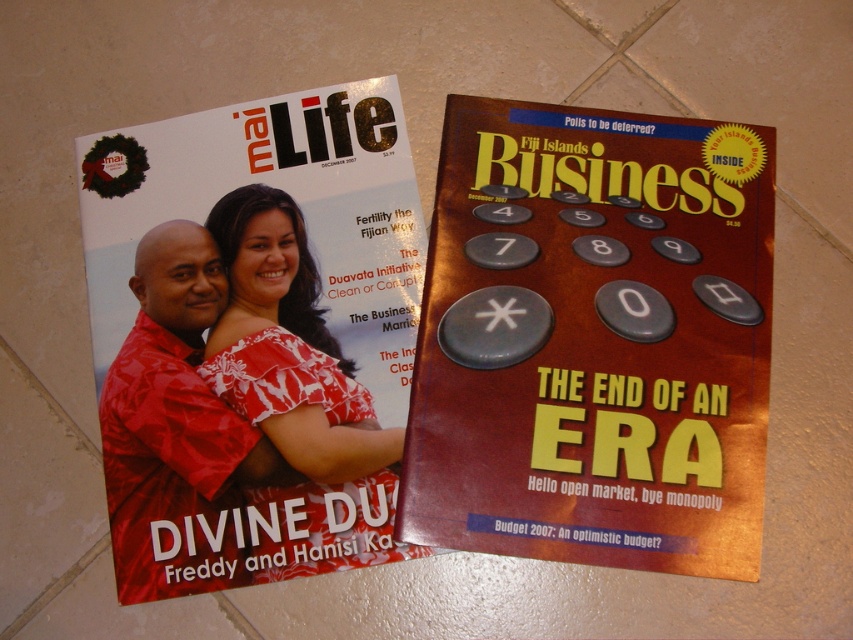
In the scene shown: Can you confirm if matte red magazine at upper left is positioned below matte red shirt at center?

No, matte red magazine at upper left is not below matte red shirt at center.

The image size is (853, 640). In order to click on matte red magazine at upper left in this screenshot , I will do coord(204,336).

The height and width of the screenshot is (640, 853). I want to click on matte red magazine at upper left, so click(204, 336).

Is matte red magazine at upper left wider than white floral dress at center?

Correct, the width of matte red magazine at upper left exceeds that of white floral dress at center.

Does point (218, 531) come closer to viewer compared to point (312, 264)?

Yes, point (218, 531) is closer to viewer.

Does point (235, 416) come in front of point (329, 444)?

No, (235, 416) is behind (329, 444).

Find the location of `matte red magazine at upper left`. matte red magazine at upper left is located at coordinates (204, 336).

Who is lower down, metallic gold magazine at right or white floral dress at center?

white floral dress at center

Describe the element at coordinates (593, 340) in the screenshot. This screenshot has height=640, width=853. I see `metallic gold magazine at right` at that location.

Identify the location of metallic gold magazine at right. Image resolution: width=853 pixels, height=640 pixels. (593, 340).

The width and height of the screenshot is (853, 640). What are the coordinates of `metallic gold magazine at right` in the screenshot? It's located at (593, 340).